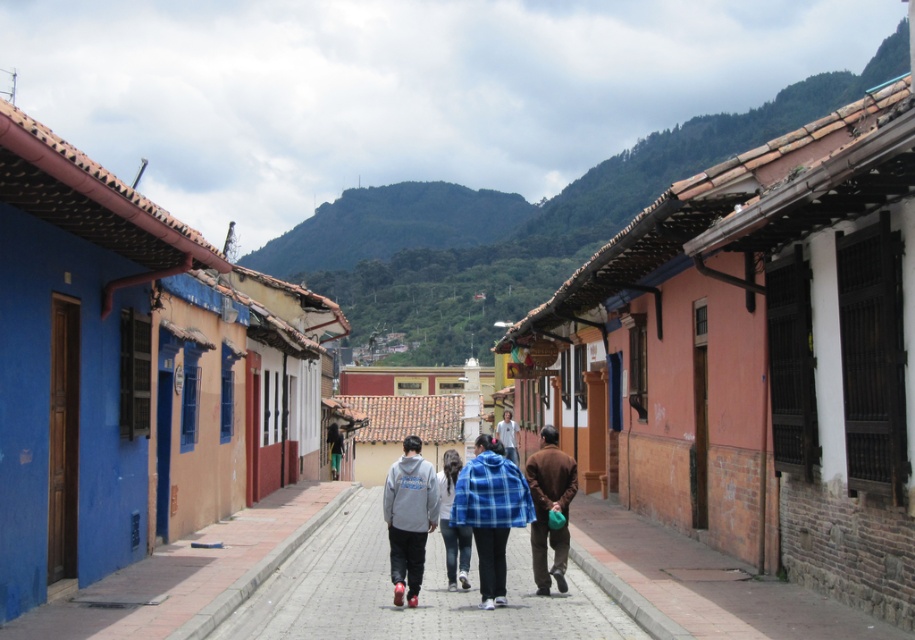
Question: Which of the following is the farthest from the observer?

Choices:
 (A) (560, 461)
 (B) (433, 497)
 (C) (60, 620)
 (D) (526, 637)

Answer: (A)

Question: Which object appears closest to the camera in this image?

Choices:
 (A) brick pavement at lower center
 (B) blue painted wall at lower left
 (C) light gray hoodie at center

Answer: (A)

Question: Is matte gray hoodie at center to the left of brown matte jacket at center from the viewer's perspective?

Choices:
 (A) yes
 (B) no

Answer: (A)

Question: Can you confirm if blue painted wall at lower left is smaller than matte gray hoodie at center?

Choices:
 (A) yes
 (B) no

Answer: (A)

Question: Which point is farther from the camera taking this photo?

Choices:
 (A) (567, 596)
 (B) (625, 566)
 (C) (404, 499)
 (D) (497, 429)

Answer: (D)

Question: Is pebble stone sidewalk at center smaller than light gray hoodie at center?

Choices:
 (A) no
 (B) yes

Answer: (A)